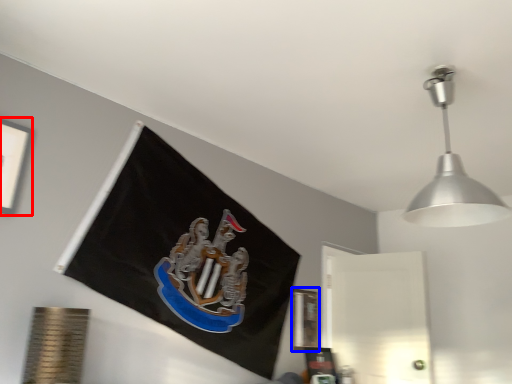
Question: Among these objects, which one is nearest to the camera, picture frame (highlighted by a red box) or picture frame (highlighted by a blue box)?

Choices:
 (A) picture frame
 (B) picture frame

Answer: (A)